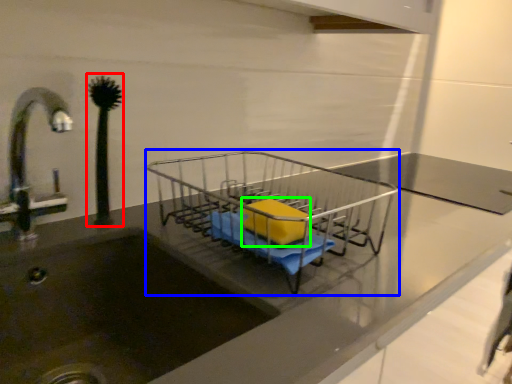
Question: Which is farther away from plant (highlighted by a red box)? trolley (highlighted by a blue box) or material (highlighted by a green box)?

Choices:
 (A) trolley
 (B) material

Answer: (A)